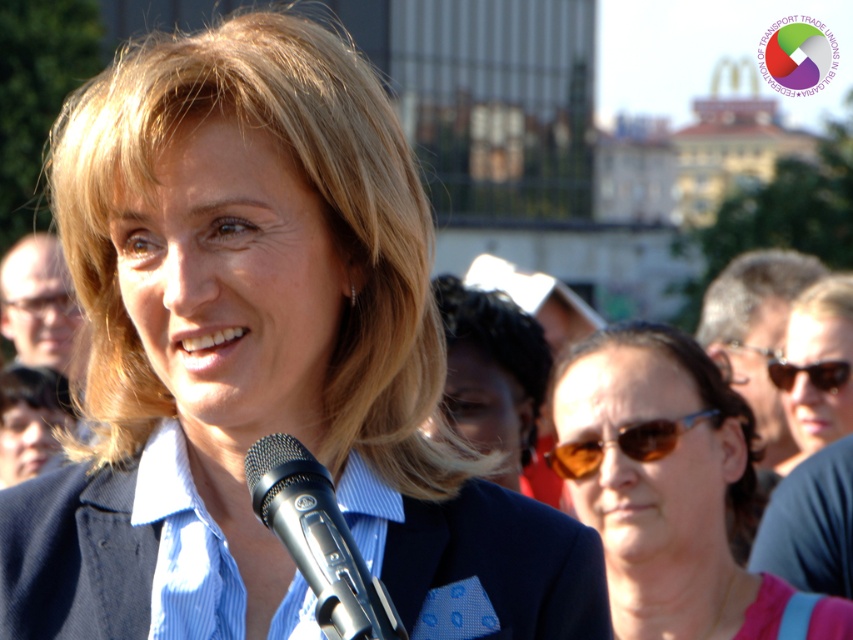
Does point (572, 582) come farther from viewer compared to point (252, 451)?

Yes, it is behind point (252, 451).

What do you see at coordinates (115, 554) in the screenshot? I see `blue fabric business suit at center` at bounding box center [115, 554].

The width and height of the screenshot is (853, 640). What are the coordinates of `blue fabric business suit at center` in the screenshot? It's located at (x=115, y=554).

Between point (519, 324) and point (838, 368), which one is positioned in front?

Point (519, 324) is more forward.

Who is more distant from viewer, (x=500, y=369) or (x=787, y=384)?

Point (x=787, y=384)

What are the coordinates of `dark brown hair at center` in the screenshot? It's located at (492, 372).

Is silver metallic microphone at center smaller than sunglasses at center?

Indeed, silver metallic microphone at center has a smaller size compared to sunglasses at center.

This screenshot has height=640, width=853. What do you see at coordinates (318, 540) in the screenshot?
I see `silver metallic microphone at center` at bounding box center [318, 540].

Where is `silver metallic microphone at center`? The width and height of the screenshot is (853, 640). silver metallic microphone at center is located at coordinates (318, 540).